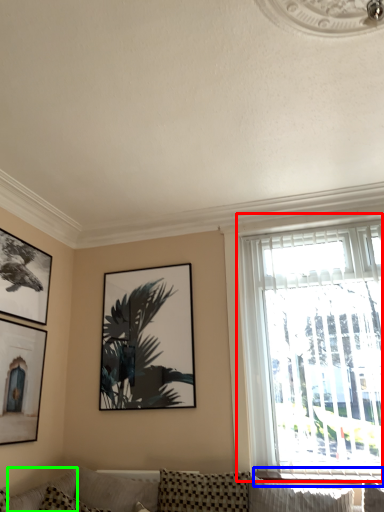
Question: Which object is positioned farthest from window (highlighted by a red box)? Select from window sill (highlighted by a blue box) and pillow (highlighted by a green box).

Choices:
 (A) window sill
 (B) pillow

Answer: (B)